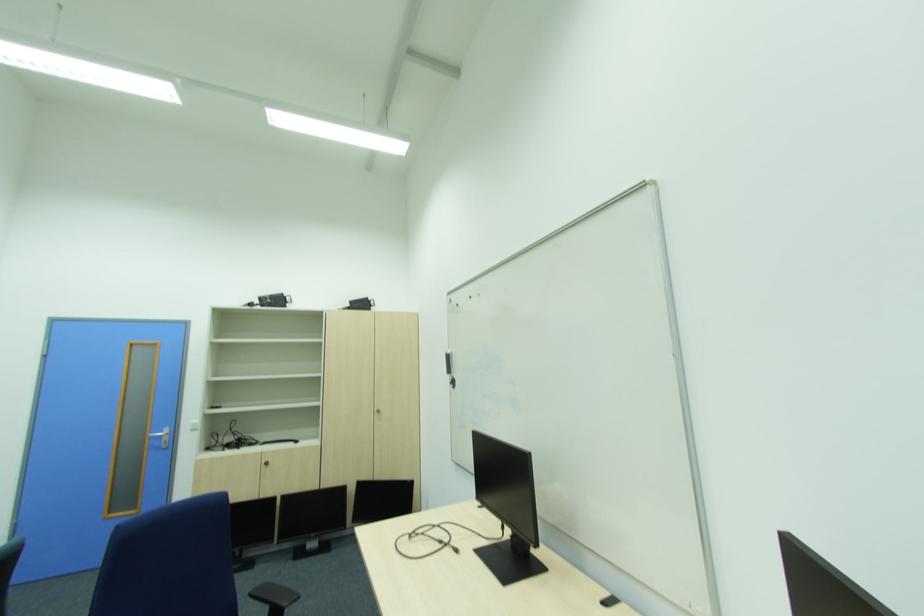
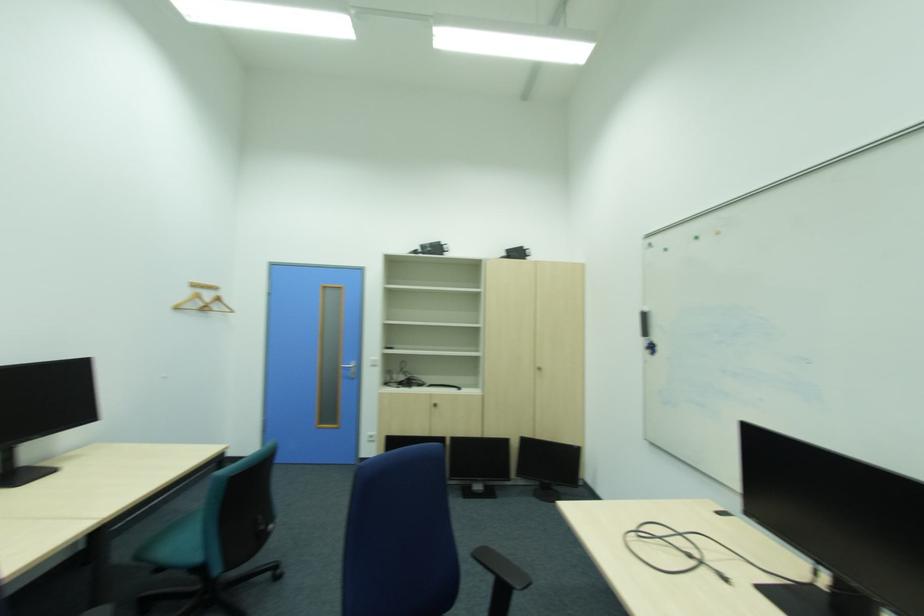
The point at (487,296) is marked in the first image. Where is the corresponding point in the second image?

(725, 233)